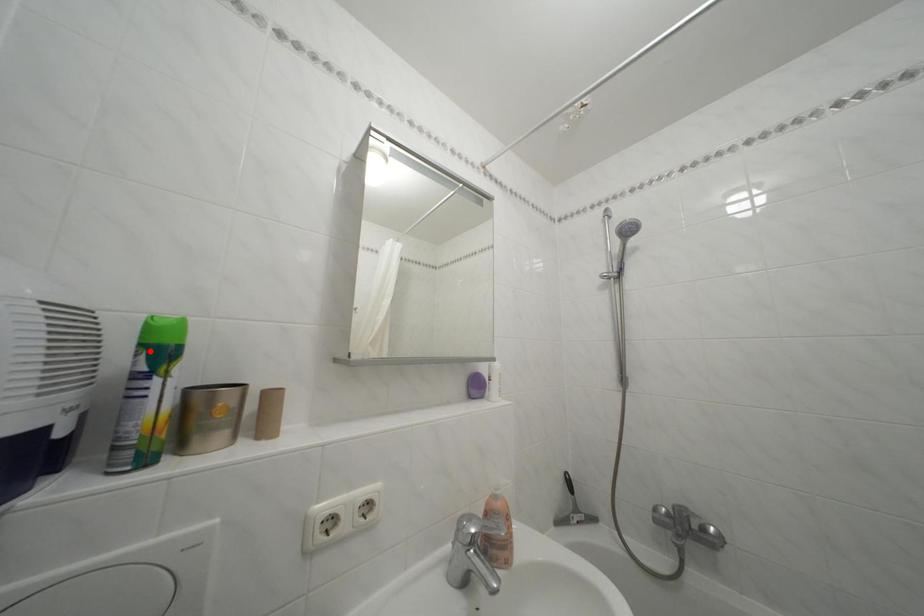
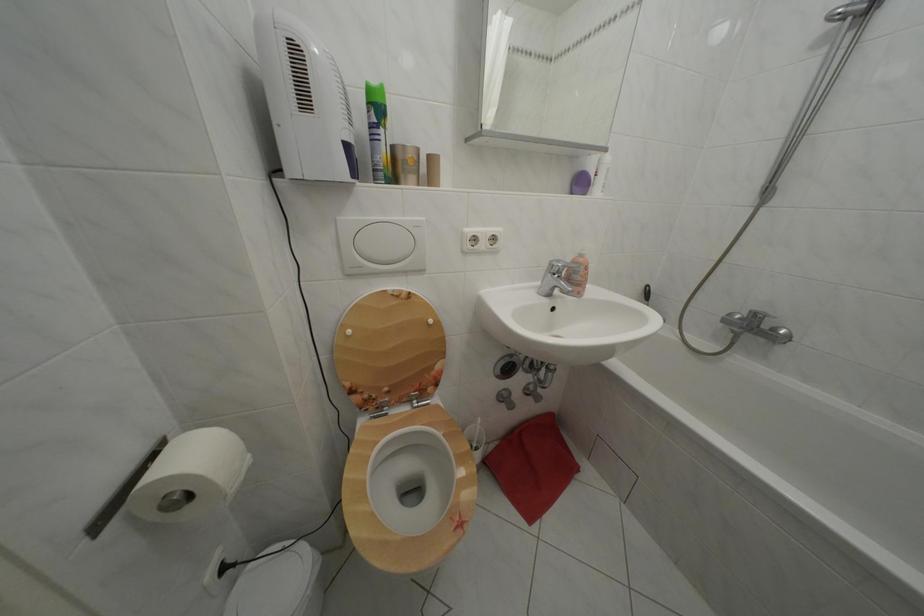
Find the pixel in the second image that matches the highlighted location in the first image.

(378, 110)